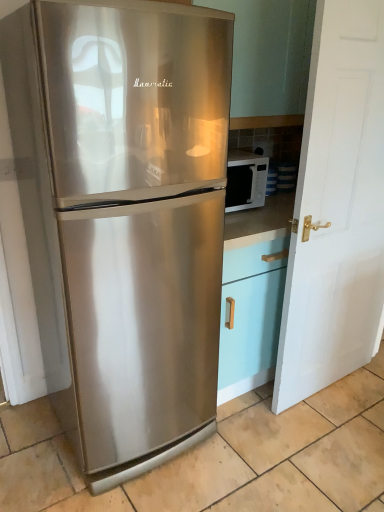
Question: Does white matte door at right have a lesser height compared to stainless steel refrigerator at left?

Choices:
 (A) no
 (B) yes

Answer: (A)

Question: Is white matte door at right touching stainless steel refrigerator at left?

Choices:
 (A) yes
 (B) no

Answer: (B)

Question: Can you confirm if white matte door at right is positioned to the right of stainless steel refrigerator at left?

Choices:
 (A) no
 (B) yes

Answer: (B)

Question: Is white matte door at right positioned behind stainless steel refrigerator at left?

Choices:
 (A) no
 (B) yes

Answer: (B)

Question: From a real-world perspective, is white matte door at right positioned under stainless steel refrigerator at left based on gravity?

Choices:
 (A) yes
 (B) no

Answer: (B)

Question: From a real-world perspective, is white matte door at right positioned over stainless steel refrigerator at left based on gravity?

Choices:
 (A) no
 (B) yes

Answer: (B)

Question: Considering the relative sizes of white matte door at right and white glossy microwave at right in the image provided, is white matte door at right smaller than white glossy microwave at right?

Choices:
 (A) yes
 (B) no

Answer: (B)

Question: Is the position of white matte door at right more distant than that of white glossy microwave at right?

Choices:
 (A) yes
 (B) no

Answer: (B)

Question: Is the depth of white matte door at right less than that of white glossy microwave at right?

Choices:
 (A) yes
 (B) no

Answer: (A)

Question: Is white matte door at right facing towards white glossy microwave at right?

Choices:
 (A) yes
 (B) no

Answer: (B)

Question: Does white matte door at right have a greater height compared to white glossy microwave at right?

Choices:
 (A) yes
 (B) no

Answer: (A)

Question: Considering the relative positions of white matte door at right and white glossy microwave at right in the image provided, is white matte door at right to the right of white glossy microwave at right from the viewer's perspective?

Choices:
 (A) no
 (B) yes

Answer: (B)

Question: From the image's perspective, is white glossy microwave at right over white matte door at right?

Choices:
 (A) yes
 (B) no

Answer: (A)